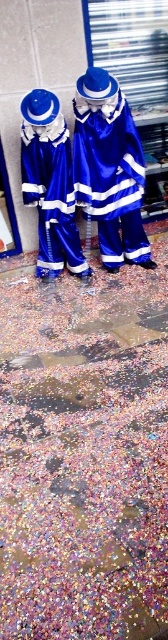
In the scene shown: Measure the distance between point (112,284) and camera.

They are 3.02 meters apart.

Based on the photo, is confetti at lower center thinner than blue satin robe at center?

In fact, confetti at lower center might be wider than blue satin robe at center.

Who is more forward, (x=26, y=538) or (x=67, y=166)?

Positioned in front is point (x=26, y=538).

Find the location of `confetti at lower center`. confetti at lower center is located at coordinates (84, 451).

Between confetti at lower center and shiny blue costume at center, which one appears on the right side from the viewer's perspective?

From the viewer's perspective, shiny blue costume at center appears more on the right side.

Which is more to the left, confetti at lower center or shiny blue costume at center?

Positioned to the left is confetti at lower center.

Who is more distant from viewer, (96, 577) or (136, 236)?

Positioned behind is point (136, 236).

Where is `confetti at lower center`? confetti at lower center is located at coordinates (84, 451).

Is point (112, 221) closer to camera compared to point (49, 208)?

No, it is not.

The image size is (168, 640). What are the coordinates of `shiny blue costume at center` in the screenshot? It's located at (110, 168).

Find the location of a particular element. The width and height of the screenshot is (168, 640). shiny blue costume at center is located at coordinates (110, 168).

Find the location of a particular element. shiny blue costume at center is located at coordinates (110, 168).